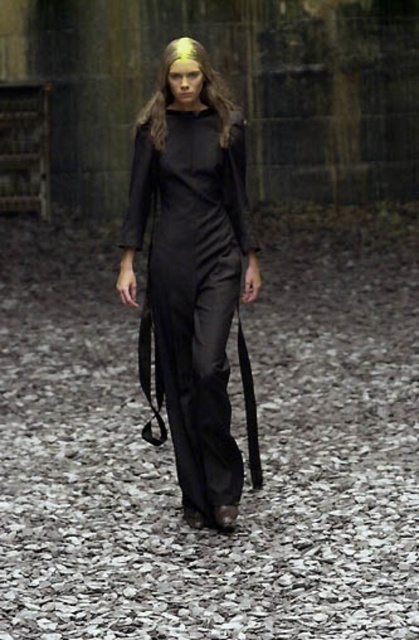
You are a fashion designer observing the image. You need to determine the placement of the satin black dress at center and golden hair at center. Which one is positioned lower in the image?

The satin black dress at center is located below golden hair at center, so the satin black dress at center is positioned lower in the image.

Based on the photo, you are a fashion designer analyzing the image. You notice the black fabric path at center and the golden hair at center. Which of these two elements takes up more visual space in the composition?

The golden hair at center takes up more visual space than the black fabric path at center, as the black fabric path at center occupies less space than golden hair at center.

You are a fashion designer observing the image. You need to determine which item, the satin black dress at center or the golden hair at center, is wider. Based on the scene, which one has a greater width?

The golden hair at center is wider than the satin black dress at center, as the description states the dress is less in width compared to the hair.